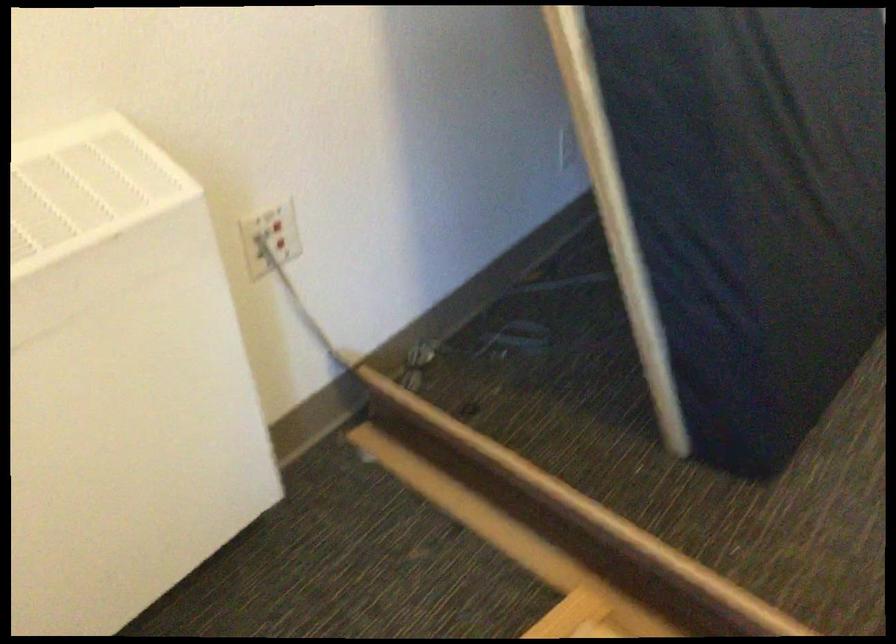
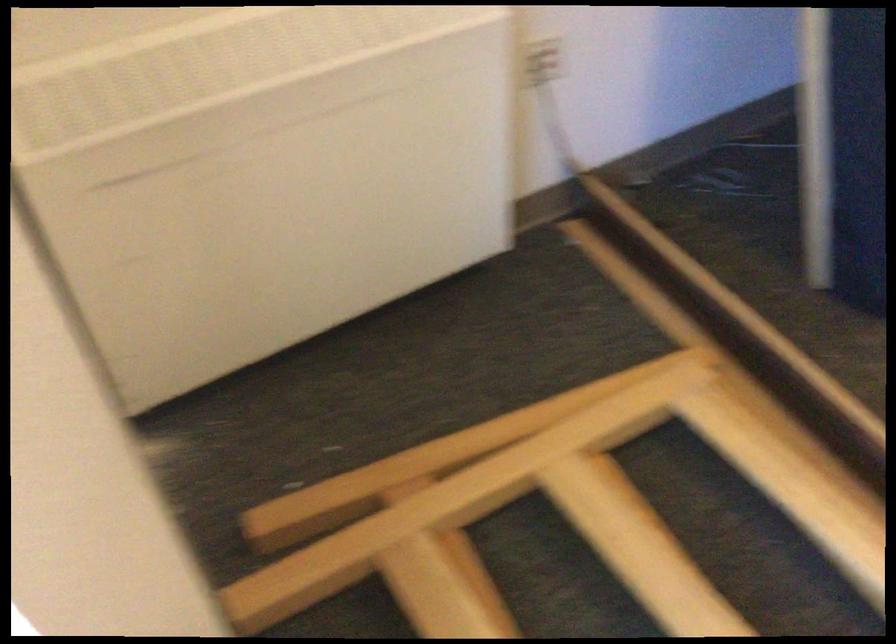
Where in the second image is the point corresponding to point 273,245 from the first image?

(543, 62)